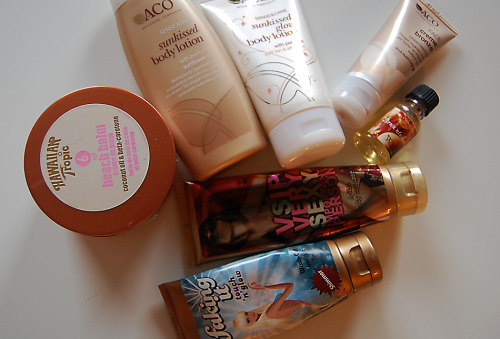
At what (x,y) coordinates should I click in order to perform the action: click on bottle of oil. Please return your answer as a coordinate pair (x, y). This screenshot has height=339, width=500. Looking at the image, I should click on (397, 120).